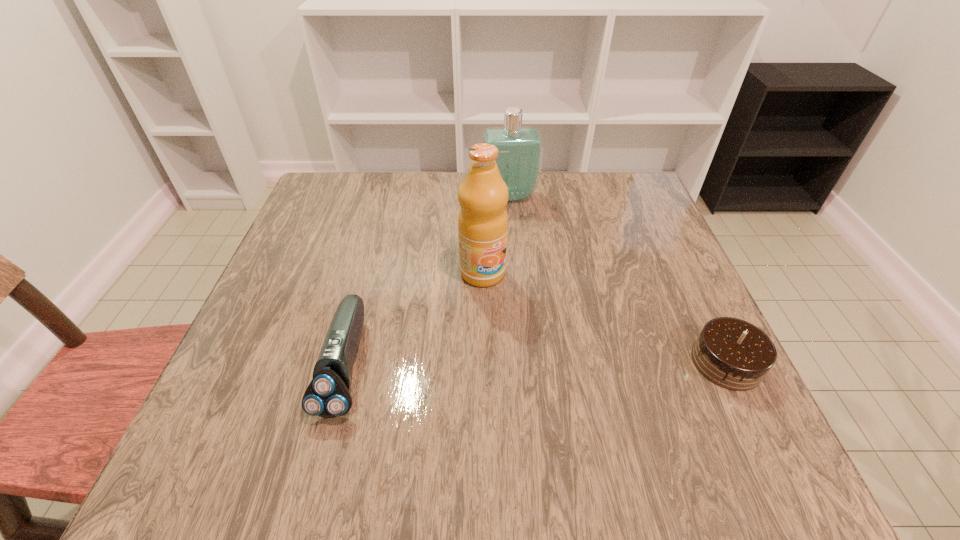
Where is `electric shaver`? electric shaver is located at coordinates (328, 395).

Image resolution: width=960 pixels, height=540 pixels. In order to click on the rightmost object in this screenshot , I will do `click(734, 354)`.

I want to click on perfume, so click(520, 148).

The height and width of the screenshot is (540, 960). Find the location of `the farthest object`. the farthest object is located at coordinates (520, 148).

Where is `fruit juice`? The image size is (960, 540). fruit juice is located at coordinates (483, 195).

This screenshot has height=540, width=960. Find the location of `the tallest object`. the tallest object is located at coordinates (483, 195).

Where is `free location located 0.240m on the left of the chocolate cake`? Image resolution: width=960 pixels, height=540 pixels. free location located 0.240m on the left of the chocolate cake is located at coordinates (564, 362).

This screenshot has width=960, height=540. I want to click on free space located 0.270m on the front label of the farthest object, so click(526, 276).

The height and width of the screenshot is (540, 960). I want to click on vacant space situated 0.230m on the front label of the farthest object, so click(x=523, y=264).

You are a GUI agent. You are given a task and a screenshot of the screen. Output one action in this format:
    pyautogui.click(x=<x>, y=<y>)
    Task: Click on the vacant point located 0.150m on the front label of the farthest object
    The width and height of the screenshot is (960, 540).
    Given the screenshot: What is the action you would take?
    pyautogui.click(x=518, y=242)